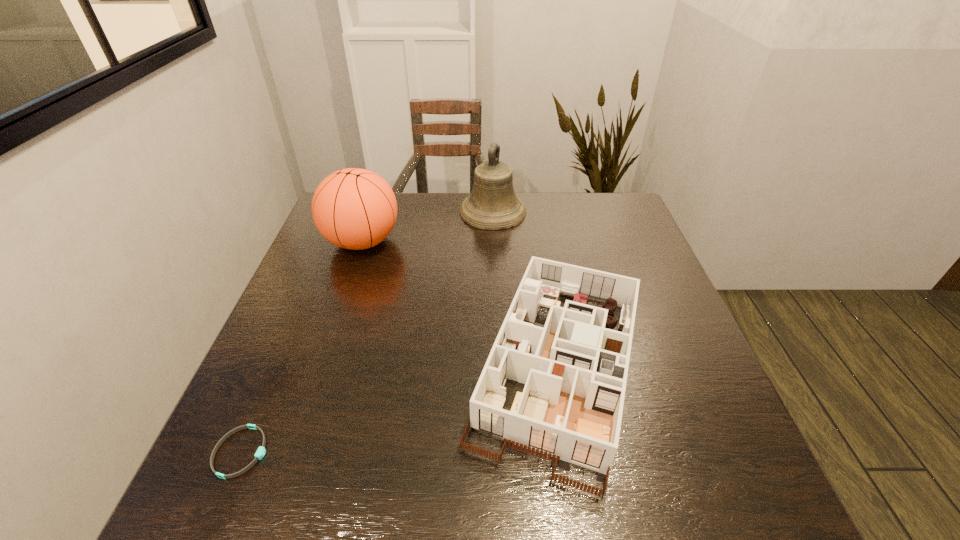
You are a GUI agent. You are given a task and a screenshot of the screen. Output one action in this format:
    pyautogui.click(x=<x>, y=<y>)
    Task: Click on the vacant space at the left edge of the desktop
    Image resolution: width=960 pixels, height=540 pixels.
    Given the screenshot: What is the action you would take?
    pyautogui.click(x=312, y=267)

Where is `free region at the right edge of the desktop`? The width and height of the screenshot is (960, 540). free region at the right edge of the desktop is located at coordinates (692, 372).

In the image, there is a desktop. Where is `vacant space at the near left corner`? The image size is (960, 540). vacant space at the near left corner is located at coordinates (296, 467).

Where is `free region at the far right corner of the desktop`? The width and height of the screenshot is (960, 540). free region at the far right corner of the desktop is located at coordinates (633, 212).

Where is `free space at the near right corner of the desktop`? The width and height of the screenshot is (960, 540). free space at the near right corner of the desktop is located at coordinates (764, 507).

At what (x,y) coordinates should I click in order to perform the action: click on vacant space that's between the basketball and the dollhouse. Please return your answer as a coordinate pair (x, y). Looking at the image, I should click on (460, 305).

Image resolution: width=960 pixels, height=540 pixels. Identify the location of free point between the wristband and the dollhouse. (399, 410).

Where is `free space that is in between the wristband and the basketball`? free space that is in between the wristband and the basketball is located at coordinates (301, 347).

Identify the location of free point between the basketball and the bell. This screenshot has height=540, width=960. (427, 226).

You are a GUI agent. You are given a task and a screenshot of the screen. Output one action in this format:
    pyautogui.click(x=<x>, y=<y>)
    Task: Click on the free point between the basketball and the third tallest object
    The width and height of the screenshot is (960, 540).
    Given the screenshot: What is the action you would take?
    pyautogui.click(x=460, y=305)